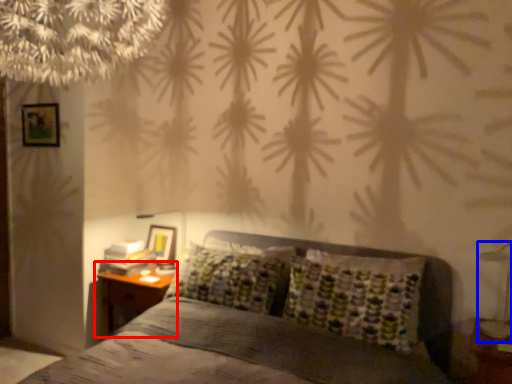
Question: Among these objects, which one is farthest to the camera, nightstand (highlighted by a red box) or bedside lamp (highlighted by a blue box)?

Choices:
 (A) nightstand
 (B) bedside lamp

Answer: (A)